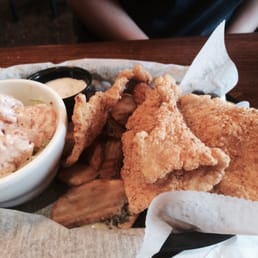
Where is `white ceramic bowl`? white ceramic bowl is located at coordinates (35, 175).